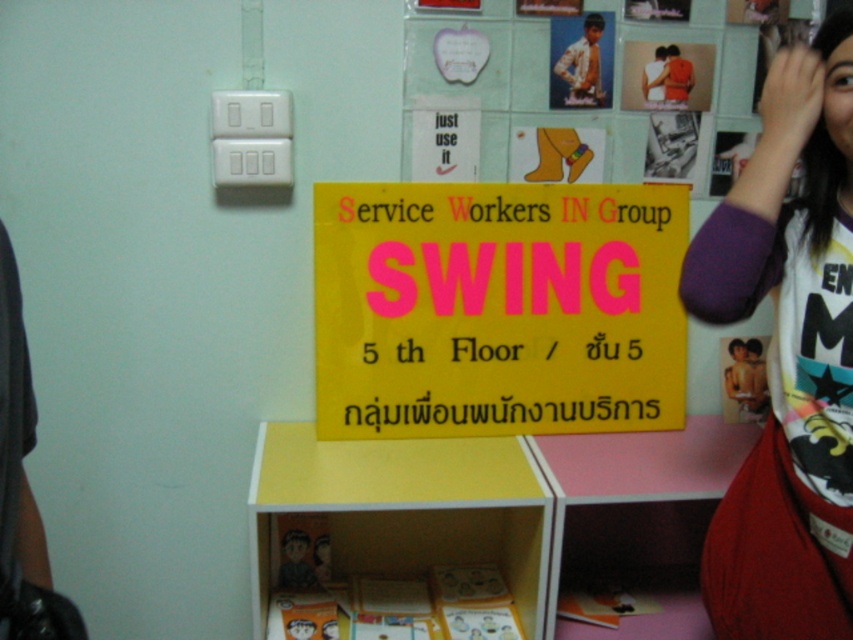
Which is above, yellow matte sign at center or white printed t-shirt at upper right?

yellow matte sign at center

Does yellow matte sign at center have a greater width compared to white printed t-shirt at upper right?

Yes, yellow matte sign at center is wider than white printed t-shirt at upper right.

At what (x,y) coordinates should I click in order to perform the action: click on yellow matte sign at center. Please return your answer as a coordinate pair (x, y). The width and height of the screenshot is (853, 640). Looking at the image, I should click on (497, 308).

You are a GUI agent. You are given a task and a screenshot of the screen. Output one action in this format:
    pyautogui.click(x=<x>, y=<y>)
    Task: Click on the yellow matte sign at center
    This screenshot has width=853, height=640.
    Given the screenshot: What is the action you would take?
    pyautogui.click(x=497, y=308)